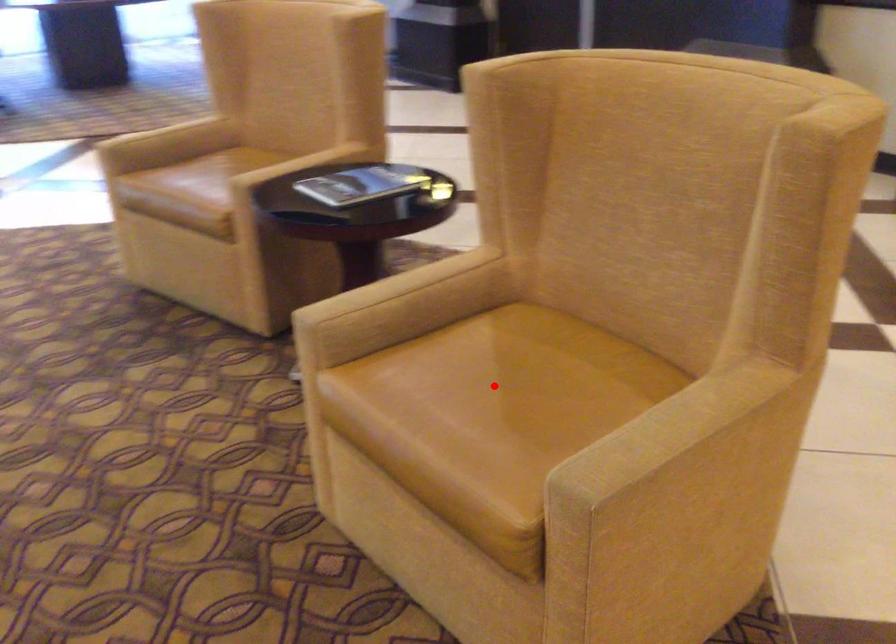
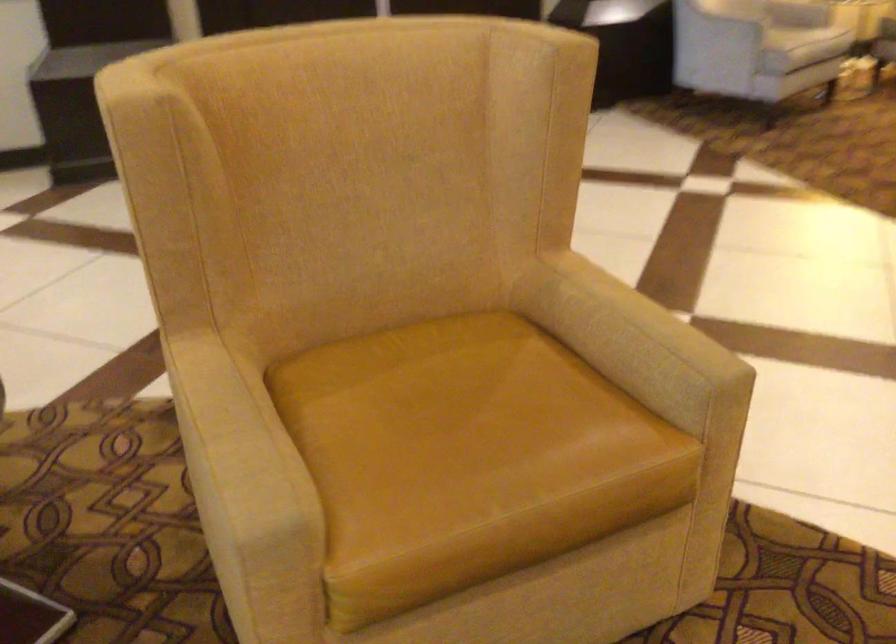
In the second image, find the point that corresponds to the highlighted location in the first image.

(452, 426)